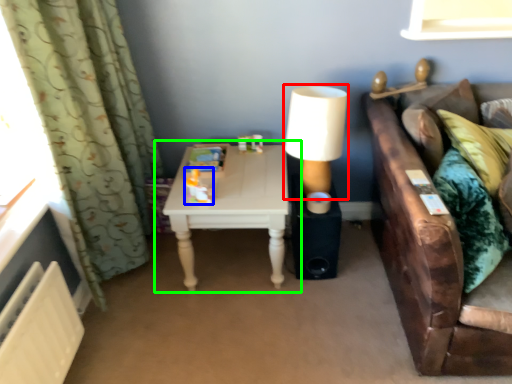
Question: Considering the real-world distances, which object is farthest from table lamp (highlighted by a red box)? toy (highlighted by a blue box) or table (highlighted by a green box)?

Choices:
 (A) toy
 (B) table

Answer: (A)